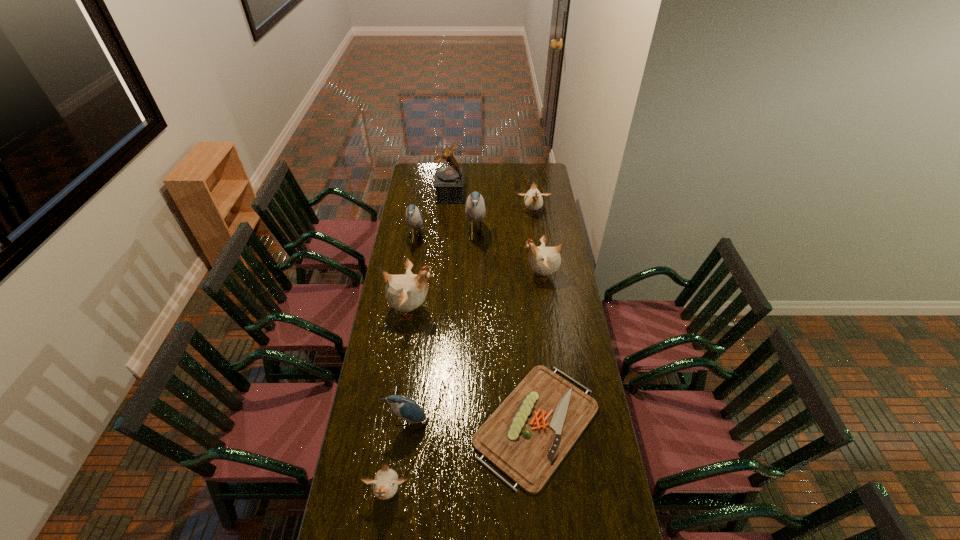
Where is `vacant point located between the biggest white bird and the third smallest white bird`? vacant point located between the biggest white bird and the third smallest white bird is located at coordinates (476, 292).

Locate an element on the screen. This screenshot has width=960, height=540. vacant space that is in between the nearest blue bird and the biggest blue bird is located at coordinates (441, 328).

Locate an element on the screen. The image size is (960, 540). vacant space that is in between the farthest object and the second smallest white bird is located at coordinates (492, 203).

Where is `free space between the biggest white bird and the third bird from right to left`? This screenshot has width=960, height=540. free space between the biggest white bird and the third bird from right to left is located at coordinates [x=444, y=272].

Identify the location of free space between the sixth farthest bird and the farthest white bird. This screenshot has height=540, width=960. (469, 317).

The height and width of the screenshot is (540, 960). In order to click on object that can be found as the eighth closest to the nearest bird in this screenshot , I will do `click(448, 181)`.

Locate which object ranks seventh in proximity to the third biggest white bird. Please provide its 2D coordinates. Your answer should be formatted as a tuple, i.e. [(x, y)], where the tuple contains the x and y coordinates of a point satisfying the conditions above.

[(405, 408)]

Identify the location of bird that is the third closest one to the smallest white bird. This screenshot has width=960, height=540. (544, 260).

Choose which bird is the nearest neighbor to the second smallest blue bird. Please provide its 2D coordinates. Your answer should be formatted as a tuple, i.e. [(x, y)], where the tuple contains the x and y coordinates of a point satisfying the conditions above.

[(406, 292)]

Where is `blue bird that is the closest to the second smallest blue bird`? The width and height of the screenshot is (960, 540). blue bird that is the closest to the second smallest blue bird is located at coordinates (x=475, y=209).